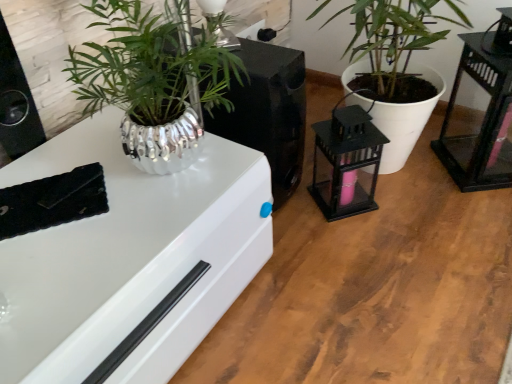
You are a GUI agent. You are given a task and a screenshot of the screen. Output one action in this format:
    pyautogui.click(x=<x>, y=<y>)
    Task: Click on the free space to the left of black glass table at right
    This screenshot has height=384, width=512.
    Given the screenshot: What is the action you would take?
    pyautogui.click(x=416, y=179)